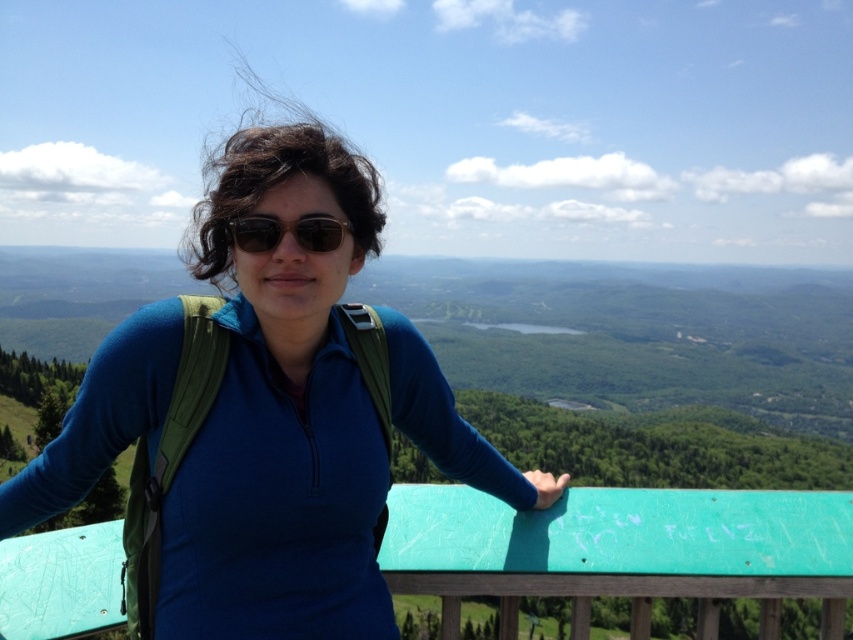
Question: From the image, what is the correct spatial relationship of blue fabric shirt at center in relation to black matte sunglasses at center?

Choices:
 (A) above
 (B) below

Answer: (B)

Question: Which point is farther from the camera taking this photo?

Choices:
 (A) (225, 477)
 (B) (257, 244)

Answer: (B)

Question: Is blue fabric shirt at center in front of black matte sunglasses at center?

Choices:
 (A) yes
 (B) no

Answer: (A)

Question: Does blue fabric shirt at center have a greater width compared to black matte sunglasses at center?

Choices:
 (A) yes
 (B) no

Answer: (A)